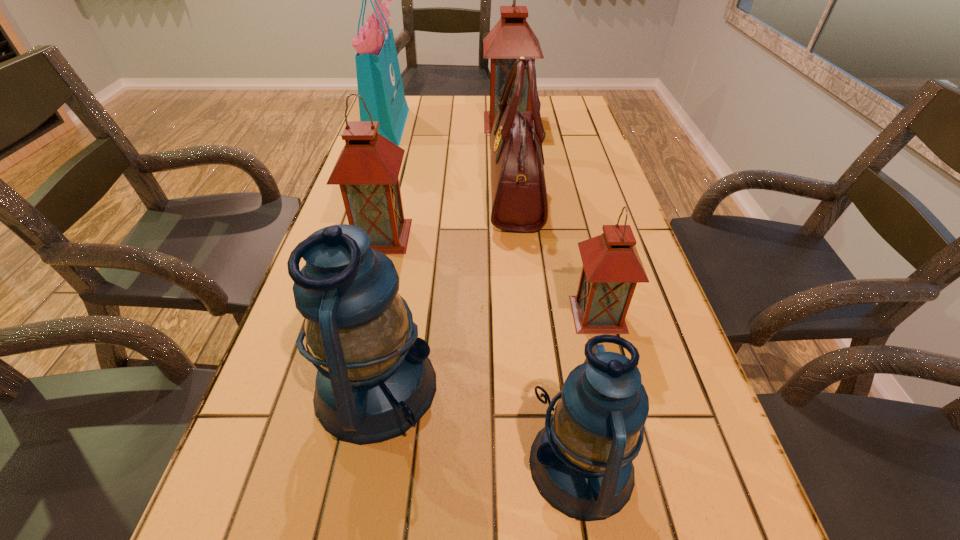
Find the location of a particular element. lantern located in the far edge section of the desktop is located at coordinates (512, 37).

This screenshot has height=540, width=960. In order to click on shopping bag that is at the far edge in this screenshot , I will do `click(379, 81)`.

You are a GUI agent. You are given a task and a screenshot of the screen. Output one action in this format:
    pyautogui.click(x=<x>, y=<y>)
    Task: Click on the shopping bag that is at the left edge
    
    Given the screenshot: What is the action you would take?
    pyautogui.click(x=379, y=81)

This screenshot has height=540, width=960. I want to click on object located in the far left corner section of the desktop, so click(x=379, y=81).

I want to click on free space at the far edge, so click(479, 107).

In the image, there is a desktop. In order to click on vacant space at the left edge in this screenshot , I will do `click(288, 335)`.

Locate an element on the screen. Image resolution: width=960 pixels, height=540 pixels. free space at the right edge of the desktop is located at coordinates (666, 532).

In the image, there is a desktop. Where is `vacant space at the far right corner`? vacant space at the far right corner is located at coordinates (542, 105).

At what (x,y) coordinates should I click in order to perform the action: click on empty space that is in between the right blue lantern and the farthest lantern. Please return your answer as a coordinate pair (x, y). This screenshot has height=540, width=960. Looking at the image, I should click on (545, 293).

Identify the location of vacant area that lies between the brown handbag and the smallest pink lantern. The image size is (960, 540). (557, 253).